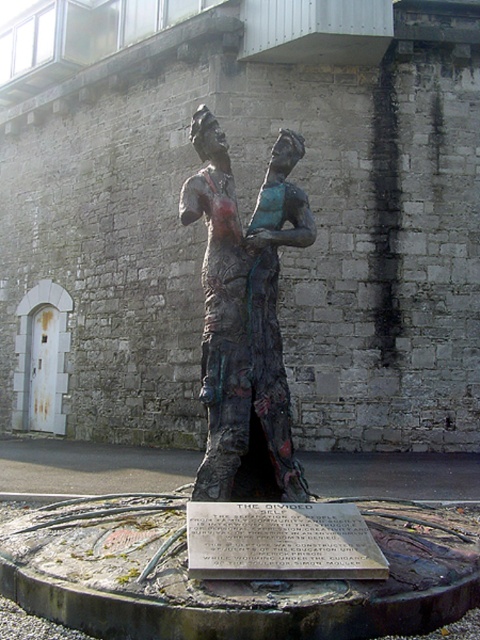
Question: Does bronze textured figures at center have a smaller size compared to bronze plaque at center?

Choices:
 (A) no
 (B) yes

Answer: (A)

Question: Does bronze textured figures at center appear over bronze plaque at center?

Choices:
 (A) no
 (B) yes

Answer: (B)

Question: Which point is closer to the camera taking this photo?

Choices:
 (A) (222, 253)
 (B) (295, 552)

Answer: (B)

Question: Is bronze textured figures at center bigger than bronze plaque at center?

Choices:
 (A) no
 (B) yes

Answer: (B)